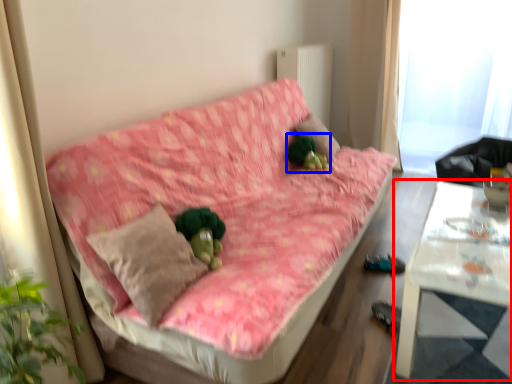
Question: Which object is further to the camera taking this photo, table (highlighted by a red box) or toy (highlighted by a blue box)?

Choices:
 (A) table
 (B) toy

Answer: (B)